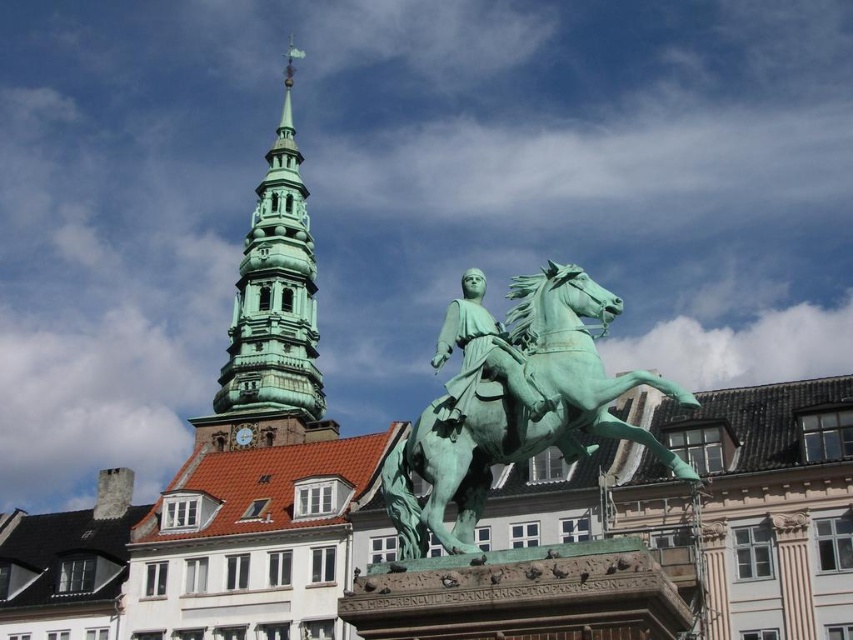
You are an architect planning to install a new lighting system for the green patinated bronze statue at center and the green polished stone tower at upper left. Based on their widths, which object requires a wider base for its lighting fixtures?

The green polished stone tower at upper left requires a wider base for its lighting fixtures since its width surpasses that of the green patinated bronze statue at center.

You are an art student analyzing the composition of the image. You observe the green patinated metal horse at center and the green polished stone tower at upper left. Which object is positioned lower in the scene?

The green patinated metal horse at center is positioned lower than the green polished stone tower at upper left.